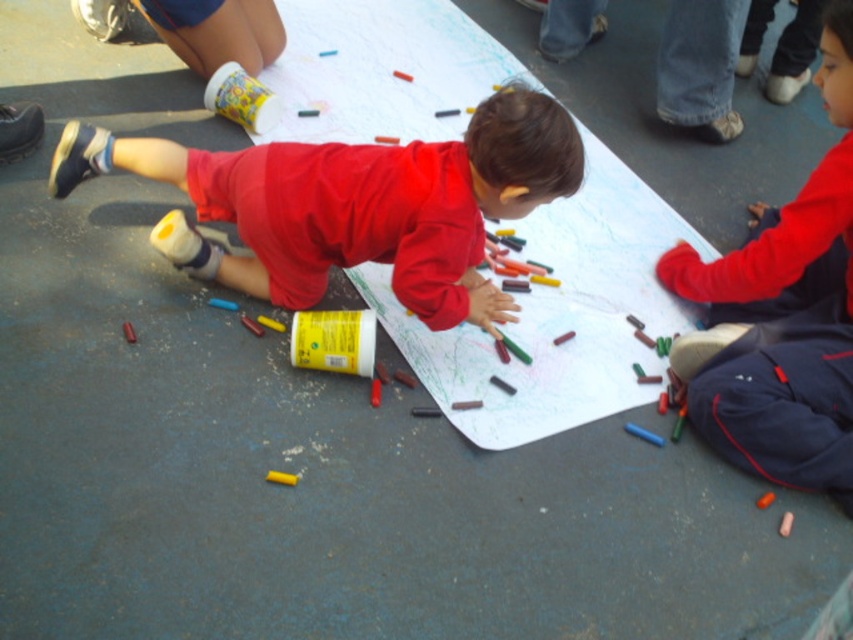
Question: Which object appears closest to the camera in this image?

Choices:
 (A) matte red shirt at lower right
 (B) matte red shirt at center

Answer: (B)

Question: Which of the following is the closest to the observer?

Choices:
 (A) (407, 170)
 (B) (796, 241)

Answer: (A)

Question: Among these objects, which one is farthest from the camera?

Choices:
 (A) matte red shirt at center
 (B) matte red shirt at lower right

Answer: (B)

Question: Is matte red shirt at center smaller than matte red shirt at lower right?

Choices:
 (A) yes
 (B) no

Answer: (B)

Question: Does matte red shirt at center come in front of matte red shirt at lower right?

Choices:
 (A) no
 (B) yes

Answer: (B)

Question: Can you confirm if matte red shirt at center is smaller than matte red shirt at lower right?

Choices:
 (A) no
 (B) yes

Answer: (A)